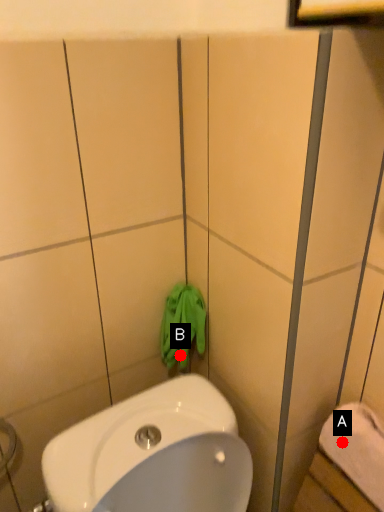
Question: Two points are circled on the image, labeled by A and B beside each circle. Which of the following is the farthest from the observer?

Choices:
 (A) A is further
 (B) B is further

Answer: (B)